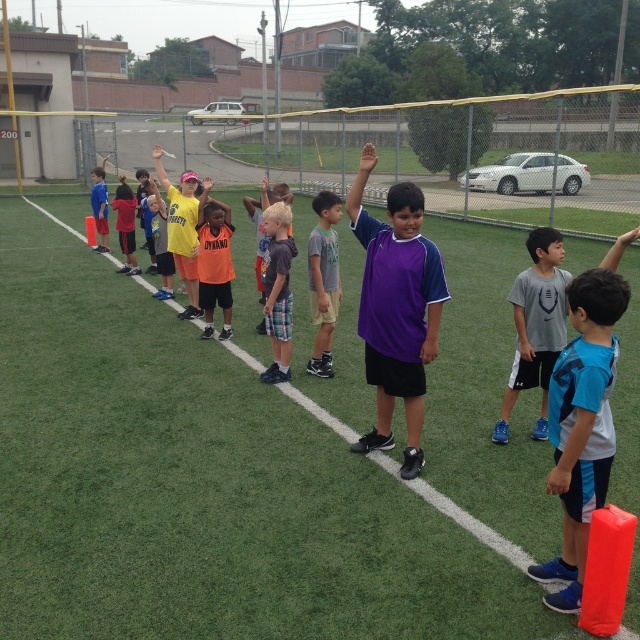
Question: Which of the following is the closest to the observer?

Choices:
 (A) (291, 317)
 (B) (211, 296)
 (C) (321, 280)

Answer: (C)

Question: Can you confirm if purple jersey at center is bigger than orange jersey at center?

Choices:
 (A) no
 (B) yes

Answer: (B)

Question: Is orange jersey at center in front of matte blue shirt at center?

Choices:
 (A) yes
 (B) no

Answer: (A)

Question: Which point is farther to the camera?

Choices:
 (A) green artificial turf at center
 (B) orange cotton shirt at center
 (C) blue fabric shirt at center

Answer: (B)

Question: Observing the image, what is the correct spatial positioning of gray cotton shirt at center in reference to orange jersey at center?

Choices:
 (A) left
 (B) right

Answer: (B)

Question: Estimate the real-world distances between objects in this image. Which object is farther from the blue fabric shirt at center?

Choices:
 (A) purple jersey at center
 (B) matte blue shirt at center

Answer: (B)